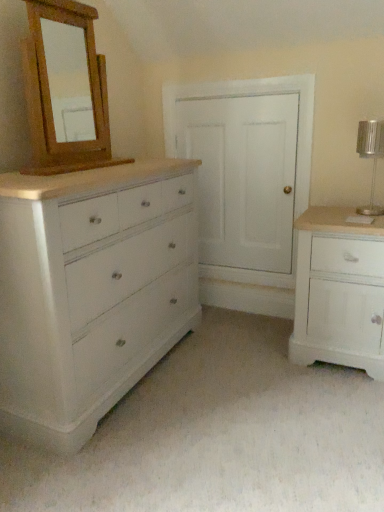
Image resolution: width=384 pixels, height=512 pixels. In order to click on wooden mirror at upper left in this screenshot , I will do `click(65, 96)`.

The width and height of the screenshot is (384, 512). I want to click on silver metallic table lamp at right, so click(x=371, y=157).

Identify the location of wooden mirror at upper left. Image resolution: width=384 pixels, height=512 pixels. [x=65, y=96].

Is the surface of white painted wood cabinet at right, arranged as the 2th chest of drawers when viewed from the left, in direct contact with white painted wood chest of drawers at left, marked as the second chest of drawers in a right-to-left arrangement?

No, white painted wood cabinet at right, arranged as the 2th chest of drawers when viewed from the left, is not making contact with white painted wood chest of drawers at left, marked as the second chest of drawers in a right-to-left arrangement.

In order to click on chest of drawers in front of the white painted wood cabinet at right, arranged as the 2th chest of drawers when viewed from the left in this screenshot , I will do `click(91, 291)`.

Between white painted wood cabinet at right, which is counted as the 1th chest of drawers, starting from the right, and white painted wood chest of drawers at left, the 1th chest of drawers viewed from the left, which one is positioned in front?

white painted wood chest of drawers at left, the 1th chest of drawers viewed from the left, is closer to the camera.

Consider the image. Is wooden mirror at upper left at the left side of white painted wood cabinet at right, arranged as the 2th chest of drawers when viewed from the left?

Yes, wooden mirror at upper left is to the left of white painted wood cabinet at right, arranged as the 2th chest of drawers when viewed from the left.

Is wooden mirror at upper left next to white painted wood cabinet at right, arranged as the 2th chest of drawers when viewed from the left?

No.

Consider the image. Does wooden mirror at upper left have a larger size compared to white painted wood cabinet at right, arranged as the 2th chest of drawers when viewed from the left?

Actually, wooden mirror at upper left might be smaller than white painted wood cabinet at right, arranged as the 2th chest of drawers when viewed from the left.

From a real-world perspective, which chest of drawers is the 2nd one underneath the wooden mirror at upper left? Please provide its 2D coordinates.

[(339, 291)]

From a real-world perspective, which object stands above the other?

In real-world perspective, silver metallic table lamp at right is above.

In the scene shown: Could white painted wood cabinet at right, arranged as the 2th chest of drawers when viewed from the left, be considered to be inside silver metallic table lamp at right?

Definitely not — white painted wood cabinet at right, arranged as the 2th chest of drawers when viewed from the left, is not inside silver metallic table lamp at right.

This screenshot has width=384, height=512. In order to click on the 1st chest of drawers in front when counting from the silver metallic table lamp at right in this screenshot , I will do `click(339, 291)`.

Which object is positioned more to the left, silver metallic table lamp at right or white painted wood cabinet at right, which is counted as the 1th chest of drawers, starting from the right?

From the viewer's perspective, white painted wood cabinet at right, which is counted as the 1th chest of drawers, starting from the right, appears more on the left side.

From a real-world perspective, relative to white painted wood chest of drawers at left, marked as the second chest of drawers in a right-to-left arrangement, is silver metallic table lamp at right vertically above or below?

silver metallic table lamp at right is situated higher than white painted wood chest of drawers at left, marked as the second chest of drawers in a right-to-left arrangement, in the real world.

Considering the sizes of objects silver metallic table lamp at right and white painted wood chest of drawers at left, the 1th chest of drawers viewed from the left, in the image provided, who is bigger, silver metallic table lamp at right or white painted wood chest of drawers at left, the 1th chest of drawers viewed from the left,?

white painted wood chest of drawers at left, the 1th chest of drawers viewed from the left, is bigger.

Considering the relative sizes of silver metallic table lamp at right and white painted wood chest of drawers at left, marked as the second chest of drawers in a right-to-left arrangement, in the image provided, is silver metallic table lamp at right taller than white painted wood chest of drawers at left, marked as the second chest of drawers in a right-to-left arrangement,?

In fact, silver metallic table lamp at right may be shorter than white painted wood chest of drawers at left, marked as the second chest of drawers in a right-to-left arrangement.

Is white painted wood chest of drawers at left, marked as the second chest of drawers in a right-to-left arrangement, located within silver metallic table lamp at right?

No, white painted wood chest of drawers at left, marked as the second chest of drawers in a right-to-left arrangement, is not inside silver metallic table lamp at right.

Could you tell me if wooden mirror at upper left is turned towards silver metallic table lamp at right?

Yes, wooden mirror at upper left is oriented towards silver metallic table lamp at right.

Which is correct: wooden mirror at upper left is inside silver metallic table lamp at right, or outside of it?

wooden mirror at upper left exists outside the volume of silver metallic table lamp at right.

From a real-world perspective, is wooden mirror at upper left above or below silver metallic table lamp at right?

wooden mirror at upper left is situated higher than silver metallic table lamp at right in the real world.

Are white painted wood chest of drawers at left, the 1th chest of drawers viewed from the left, and silver metallic table lamp at right located far from each other?

Absolutely, white painted wood chest of drawers at left, the 1th chest of drawers viewed from the left, is distant from silver metallic table lamp at right.

Between point (141, 314) and point (376, 144), which one is positioned in front?

The point (141, 314) is more forward.

Find the location of `table lamp on the right of white painted wood chest of drawers at left, marked as the second chest of drawers in a right-to-left arrangement`. table lamp on the right of white painted wood chest of drawers at left, marked as the second chest of drawers in a right-to-left arrangement is located at coordinates (371, 157).

Is white painted wood chest of drawers at left, the 1th chest of drawers viewed from the left, facing towards silver metallic table lamp at right?

Yes, white painted wood chest of drawers at left, the 1th chest of drawers viewed from the left, is oriented towards silver metallic table lamp at right.

From the picture: Between white painted wood cabinet at right, arranged as the 2th chest of drawers when viewed from the left, and wooden mirror at upper left, which one has smaller width?

wooden mirror at upper left.

Can you tell me how much white painted wood cabinet at right, which is counted as the 1th chest of drawers, starting from the right, and wooden mirror at upper left differ in facing direction?

The angle between the facing direction of white painted wood cabinet at right, which is counted as the 1th chest of drawers, starting from the right, and the facing direction of wooden mirror at upper left is 89.6 degrees.

From a real-world perspective, does white painted wood cabinet at right, which is counted as the 1th chest of drawers, starting from the right, stand above wooden mirror at upper left?

Incorrect, from a real-world perspective, white painted wood cabinet at right, which is counted as the 1th chest of drawers, starting from the right, is lower than wooden mirror at upper left.

From the image's perspective, is white painted wood cabinet at right, which is counted as the 1th chest of drawers, starting from the right, over wooden mirror at upper left?

Actually, white painted wood cabinet at right, which is counted as the 1th chest of drawers, starting from the right, appears below wooden mirror at upper left in the image.

The width and height of the screenshot is (384, 512). I want to click on chest of drawers on the left of white painted wood cabinet at right, which is counted as the 1th chest of drawers, starting from the right, so click(91, 291).

Find the location of a particular element. Image resolution: width=384 pixels, height=512 pixels. medicine cabinet above the white painted wood cabinet at right, which is counted as the 1th chest of drawers, starting from the right (from a real-world perspective) is located at coordinates (65, 96).

Which object lies further to the anchor point wooden mirror at upper left, white painted wood cabinet at right, arranged as the 2th chest of drawers when viewed from the left, or silver metallic table lamp at right?

The object further to wooden mirror at upper left is silver metallic table lamp at right.

From the image, which object appears to be farther from silver metallic table lamp at right, wooden mirror at upper left or white painted wood cabinet at right, arranged as the 2th chest of drawers when viewed from the left?

The object further to silver metallic table lamp at right is wooden mirror at upper left.

Looking at the image, which one is located further to silver metallic table lamp at right, white painted wood chest of drawers at left, marked as the second chest of drawers in a right-to-left arrangement, or wooden mirror at upper left?

The object further to silver metallic table lamp at right is wooden mirror at upper left.

Estimate the real-world distances between objects in this image. Which object is further from white painted wood chest of drawers at left, the 1th chest of drawers viewed from the left, white painted wood cabinet at right, arranged as the 2th chest of drawers when viewed from the left, or wooden mirror at upper left?

white painted wood cabinet at right, arranged as the 2th chest of drawers when viewed from the left.

Based on their spatial positions, is wooden mirror at upper left or silver metallic table lamp at right closer to white painted wood cabinet at right, arranged as the 2th chest of drawers when viewed from the left?

silver metallic table lamp at right is positioned closer to the anchor white painted wood cabinet at right, arranged as the 2th chest of drawers when viewed from the left.

Which object lies nearer to the anchor point white painted wood cabinet at right, arranged as the 2th chest of drawers when viewed from the left, white painted wood chest of drawers at left, the 1th chest of drawers viewed from the left, or wooden mirror at upper left?

white painted wood chest of drawers at left, the 1th chest of drawers viewed from the left, is positioned closer to the anchor white painted wood cabinet at right, arranged as the 2th chest of drawers when viewed from the left.

Based on their spatial positions, is wooden mirror at upper left or silver metallic table lamp at right further from white painted wood chest of drawers at left, the 1th chest of drawers viewed from the left?

silver metallic table lamp at right.

When comparing their distances from silver metallic table lamp at right, does white painted wood cabinet at right, arranged as the 2th chest of drawers when viewed from the left, or white painted wood chest of drawers at left, marked as the second chest of drawers in a right-to-left arrangement, seem further?

white painted wood chest of drawers at left, marked as the second chest of drawers in a right-to-left arrangement, lies further to silver metallic table lamp at right than the other object.

Identify the location of chest of drawers between white painted wood chest of drawers at left, marked as the second chest of drawers in a right-to-left arrangement, and silver metallic table lamp at right. (339, 291).

You are a GUI agent. You are given a task and a screenshot of the screen. Output one action in this format:
    pyautogui.click(x=<x>, y=<y>)
    Task: Click on the chest of drawers between wooden mirror at upper left and white painted wood cabinet at right, arranged as the 2th chest of drawers when viewed from the left, in the horizontal direction
    Image resolution: width=384 pixels, height=512 pixels.
    Given the screenshot: What is the action you would take?
    pyautogui.click(x=91, y=291)